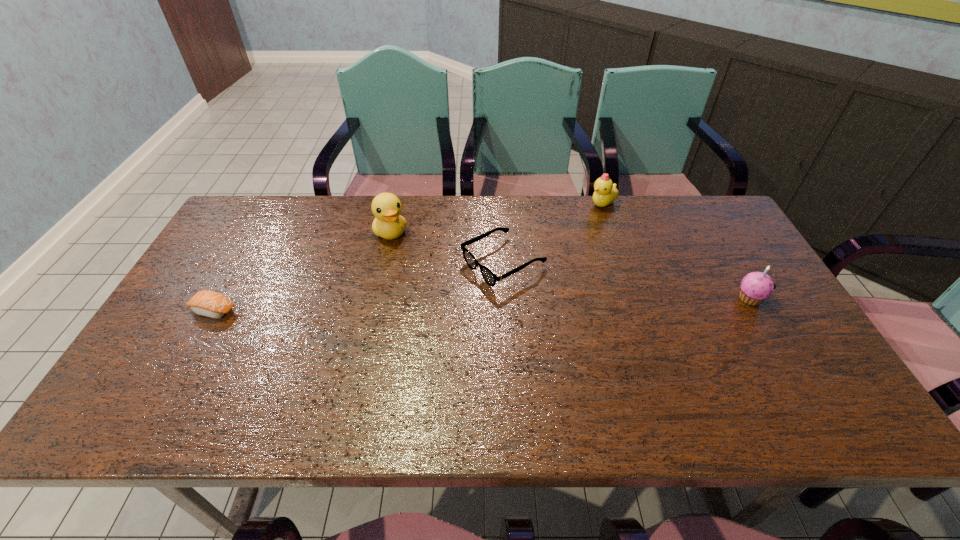
Locate an element on the screen. The width and height of the screenshot is (960, 540). duck that is positioned at the far edge is located at coordinates (389, 224).

The width and height of the screenshot is (960, 540). I want to click on duckling that is positioned at the far edge, so (x=606, y=192).

Identify the location of object that is at the left edge. (207, 303).

Find the location of a particular element. The width and height of the screenshot is (960, 540). object located in the right edge section of the desktop is located at coordinates (756, 286).

At what (x,y) coordinates should I click in order to perform the action: click on vacant space at the far edge of the desktop. Please return your answer as a coordinate pair (x, y). Image resolution: width=960 pixels, height=540 pixels. Looking at the image, I should click on (658, 232).

Identify the location of free space at the near edge of the desktop. (350, 383).

In the image, there is a desktop. Identify the location of vacant space at the left edge. This screenshot has height=540, width=960. (202, 269).

Locate an element on the screen. The height and width of the screenshot is (540, 960). free space at the right edge of the desktop is located at coordinates (785, 333).

Locate an element on the screen. The width and height of the screenshot is (960, 540). free location at the far right corner of the desktop is located at coordinates (677, 205).

Locate an element on the screen. The height and width of the screenshot is (540, 960). blank region between the duckling and the second shortest object is located at coordinates (553, 233).